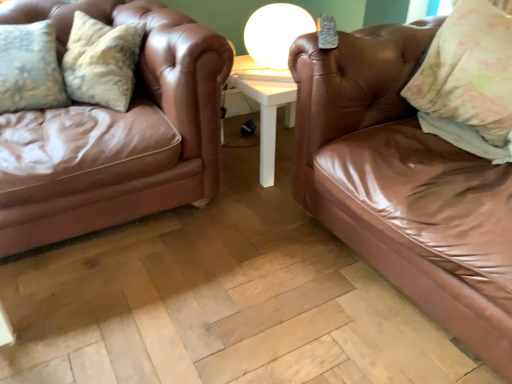
What is the approximate width of brown leather couch at left, which is the second studio couch in right-to-left order?

brown leather couch at left, which is the second studio couch in right-to-left order, is 38.79 inches wide.

Locate an element on the screen. The image size is (512, 384). shiny brown leather couch at right, which is the 2th studio couch in left-to-right order is located at coordinates (404, 184).

Locate an element on the screen. The width and height of the screenshot is (512, 384). pillow on the right of brown leather couch at left, which is the second studio couch in right-to-left order is located at coordinates (468, 81).

Consider the image. Are brown leather couch at left, which is the second studio couch in right-to-left order, and floral fabric pillow at upper right located far from each other?

No.

From the image's perspective, is brown leather couch at left, which is the first studio couch in left-to-right order, below floral fabric pillow at upper right?

Yes, from the image's perspective, brown leather couch at left, which is the first studio couch in left-to-right order, is beneath floral fabric pillow at upper right.

Considering the positions of objects brown leather couch at left, which is the second studio couch in right-to-left order, and floral fabric pillow at upper right in the image provided, who is in front, brown leather couch at left, which is the second studio couch in right-to-left order, or floral fabric pillow at upper right?

brown leather couch at left, which is the second studio couch in right-to-left order, is more forward.

Considering the relative sizes of brown leather couch at left, which is the second studio couch in right-to-left order, and shiny brown leather couch at right, which is the 2th studio couch in left-to-right order, in the image provided, is brown leather couch at left, which is the second studio couch in right-to-left order, thinner than shiny brown leather couch at right, which is the 2th studio couch in left-to-right order,?

Yes, brown leather couch at left, which is the second studio couch in right-to-left order, is thinner than shiny brown leather couch at right, which is the 2th studio couch in left-to-right order.

From a real-world perspective, which is physically above, brown leather couch at left, which is the first studio couch in left-to-right order, or shiny brown leather couch at right, which is the 2th studio couch in left-to-right order?

From a 3D spatial view, brown leather couch at left, which is the first studio couch in left-to-right order, is above.

The height and width of the screenshot is (384, 512). I want to click on studio couch on the right of brown leather couch at left, which is the first studio couch in left-to-right order, so click(404, 184).

In terms of size, does floral fabric pillow at upper right appear bigger or smaller than white glossy table lamp at upper center?

floral fabric pillow at upper right is bigger than white glossy table lamp at upper center.

Between point (457, 114) and point (313, 29), which one is positioned in front?

Point (457, 114)

From the picture: Are floral fabric pillow at upper right and white glossy table lamp at upper center making contact?

There is a gap between floral fabric pillow at upper right and white glossy table lamp at upper center.

Is point (331, 189) in front of point (31, 156)?

No, it is behind (31, 156).

Consider the image. Considering the relative sizes of shiny brown leather couch at right, which is the 2th studio couch in left-to-right order, and brown leather couch at left, which is the first studio couch in left-to-right order, in the image provided, is shiny brown leather couch at right, which is the 2th studio couch in left-to-right order, smaller than brown leather couch at left, which is the first studio couch in left-to-right order,?

No.

Considering the positions of objects shiny brown leather couch at right, the 1th studio couch in the right-to-left sequence, and brown leather couch at left, which is the second studio couch in right-to-left order, in the image provided, who is behind, shiny brown leather couch at right, the 1th studio couch in the right-to-left sequence, or brown leather couch at left, which is the second studio couch in right-to-left order,?

brown leather couch at left, which is the second studio couch in right-to-left order.

Is brown leather couch at left, which is the first studio couch in left-to-right order, at the back of shiny brown leather couch at right, which is the 2th studio couch in left-to-right order?

That's not correct — shiny brown leather couch at right, which is the 2th studio couch in left-to-right order, is not looking away from brown leather couch at left, which is the first studio couch in left-to-right order.

What's the angular difference between floral fabric pillow at upper right and brown leather couch at left, which is the second studio couch in right-to-left order,'s facing directions?

The angle between the facing direction of floral fabric pillow at upper right and the facing direction of brown leather couch at left, which is the second studio couch in right-to-left order, is 90.3 degrees.

From a real-world perspective, is floral fabric pillow at upper right positioned under brown leather couch at left, which is the second studio couch in right-to-left order, based on gravity?

Actually, floral fabric pillow at upper right is physically above brown leather couch at left, which is the second studio couch in right-to-left order, in the real world.

Between floral fabric pillow at upper right and brown leather couch at left, which is the second studio couch in right-to-left order, which one appears on the right side from the viewer's perspective?

Positioned to the right is floral fabric pillow at upper right.

From the picture: Can you see floral fabric pillow at upper right touching brown leather couch at left, which is the first studio couch in left-to-right order?

No, floral fabric pillow at upper right is not with brown leather couch at left, which is the first studio couch in left-to-right order.

From a real-world perspective, does white glossy table lamp at upper center stand above brown leather couch at left, which is the second studio couch in right-to-left order?

Indeed, from a real-world perspective, white glossy table lamp at upper center stands above brown leather couch at left, which is the second studio couch in right-to-left order.

Is there a large distance between white glossy table lamp at upper center and brown leather couch at left, which is the first studio couch in left-to-right order?

No.

From the image's perspective, would you say white glossy table lamp at upper center is shown under brown leather couch at left, which is the second studio couch in right-to-left order?

No, from the image's perspective, white glossy table lamp at upper center is not below brown leather couch at left, which is the second studio couch in right-to-left order.

Consider the image. Between shiny brown leather couch at right, which is the 2th studio couch in left-to-right order, and white glossy table lamp at upper center, which one has smaller width?

white glossy table lamp at upper center.

From a real-world perspective, is shiny brown leather couch at right, the 1th studio couch in the right-to-left sequence, positioned above or below white glossy table lamp at upper center?

shiny brown leather couch at right, the 1th studio couch in the right-to-left sequence, is situated lower than white glossy table lamp at upper center in the real world.

Is shiny brown leather couch at right, the 1th studio couch in the right-to-left sequence, facing towards white glossy table lamp at upper center?

No, shiny brown leather couch at right, the 1th studio couch in the right-to-left sequence, is not turned towards white glossy table lamp at upper center.

Find the location of a particular element. This screenshot has height=384, width=512. pillow that appears above the brown leather couch at left, which is the second studio couch in right-to-left order (from a real-world perspective) is located at coordinates (468, 81).

In the image, there is a shiny brown leather couch at right, which is the 2th studio couch in left-to-right order. Where is `studio couch above it (from the image's perspective)`? studio couch above it (from the image's perspective) is located at coordinates (115, 132).

Which object lies nearer to the anchor point brown leather couch at left, which is the second studio couch in right-to-left order, shiny brown leather couch at right, which is the 2th studio couch in left-to-right order, or white glossy table lamp at upper center?

The object closer to brown leather couch at left, which is the second studio couch in right-to-left order, is white glossy table lamp at upper center.

From the image, which object appears to be nearer to white glossy table lamp at upper center, brown leather couch at left, which is the first studio couch in left-to-right order, or shiny brown leather couch at right, which is the 2th studio couch in left-to-right order?

Among the two, brown leather couch at left, which is the first studio couch in left-to-right order, is located nearer to white glossy table lamp at upper center.

When comparing their distances from shiny brown leather couch at right, which is the 2th studio couch in left-to-right order, does floral fabric pillow at upper right or brown leather couch at left, which is the first studio couch in left-to-right order, seem further?

Among the two, brown leather couch at left, which is the first studio couch in left-to-right order, is located further to shiny brown leather couch at right, which is the 2th studio couch in left-to-right order.

Which object lies further to the anchor point brown leather couch at left, which is the first studio couch in left-to-right order, shiny brown leather couch at right, the 1th studio couch in the right-to-left sequence, or floral fabric pillow at upper right?

Based on the image, floral fabric pillow at upper right appears to be further to brown leather couch at left, which is the first studio couch in left-to-right order.

Based on the photo, which object lies nearer to the anchor point shiny brown leather couch at right, which is the 2th studio couch in left-to-right order, brown leather couch at left, which is the second studio couch in right-to-left order, or white glossy table lamp at upper center?

Based on the image, white glossy table lamp at upper center appears to be nearer to shiny brown leather couch at right, which is the 2th studio couch in left-to-right order.

When comparing their distances from floral fabric pillow at upper right, does shiny brown leather couch at right, the 1th studio couch in the right-to-left sequence, or brown leather couch at left, which is the first studio couch in left-to-right order, seem further?

Among the two, brown leather couch at left, which is the first studio couch in left-to-right order, is located further to floral fabric pillow at upper right.

When comparing their distances from floral fabric pillow at upper right, does brown leather couch at left, which is the second studio couch in right-to-left order, or white glossy table lamp at upper center seem further?

Among the two, brown leather couch at left, which is the second studio couch in right-to-left order, is located further to floral fabric pillow at upper right.

When comparing their distances from floral fabric pillow at upper right, does white glossy table lamp at upper center or brown leather couch at left, which is the first studio couch in left-to-right order, seem further?

Among the two, brown leather couch at left, which is the first studio couch in left-to-right order, is located further to floral fabric pillow at upper right.

This screenshot has width=512, height=384. What are the coordinates of `table lamp between brown leather couch at left, which is the second studio couch in right-to-left order, and shiny brown leather couch at right, which is the 2th studio couch in left-to-right order, from left to right` in the screenshot? It's located at (275, 33).

Locate an element on the screen. table lamp between brown leather couch at left, which is the first studio couch in left-to-right order, and floral fabric pillow at upper right from left to right is located at coordinates (275, 33).

You are a GUI agent. You are given a task and a screenshot of the screen. Output one action in this format:
    pyautogui.click(x=<x>, y=<y>)
    Task: Click on the studio couch between brown leather couch at left, which is the second studio couch in right-to-left order, and floral fabric pillow at upper right
    The image size is (512, 384).
    Given the screenshot: What is the action you would take?
    pyautogui.click(x=404, y=184)

The height and width of the screenshot is (384, 512). I want to click on pillow between shiny brown leather couch at right, the 1th studio couch in the right-to-left sequence, and white glossy table lamp at upper center from front to back, so click(468, 81).